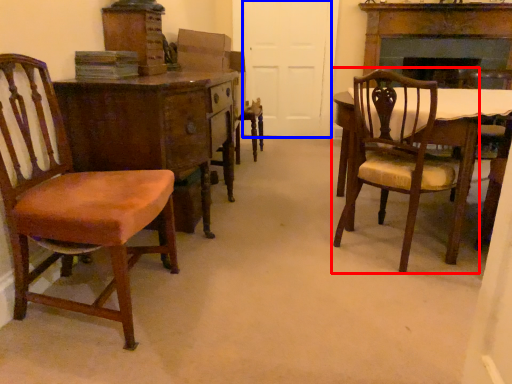
Question: Which object appears closest to the camera in this image, chair (highlighted by a red box) or door (highlighted by a blue box)?

Choices:
 (A) chair
 (B) door

Answer: (A)